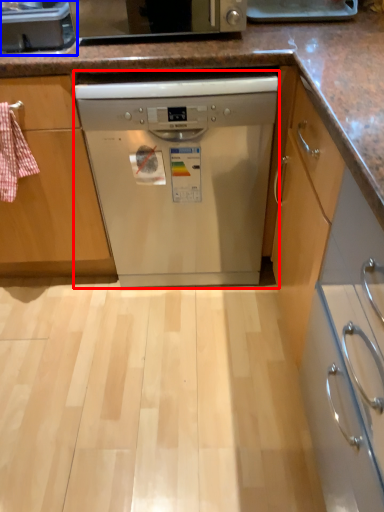
Question: Which point is further to the camera, dishwasher (highlighted by a red box) or kitchen appliance (highlighted by a blue box)?

Choices:
 (A) dishwasher
 (B) kitchen appliance

Answer: (A)